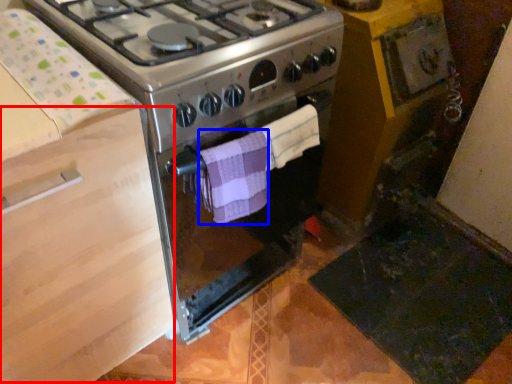
Question: Which of the following is the farthest to the observer, drawer (highlighted by a red box) or towel/napkin (highlighted by a blue box)?

Choices:
 (A) drawer
 (B) towel/napkin

Answer: (B)